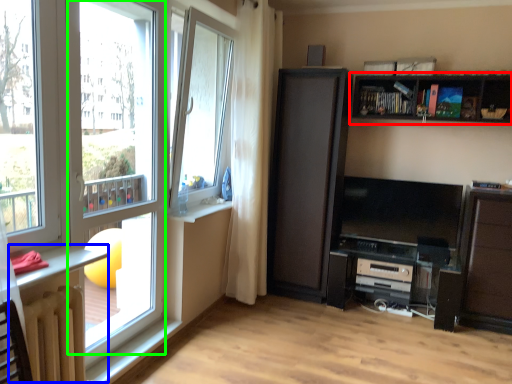
Question: Estimate the real-world distances between objects in this image. Which object is closer to shelf (highlighted by a red box), table (highlighted by a blue box) or window frame (highlighted by a green box)?

Choices:
 (A) table
 (B) window frame

Answer: (B)